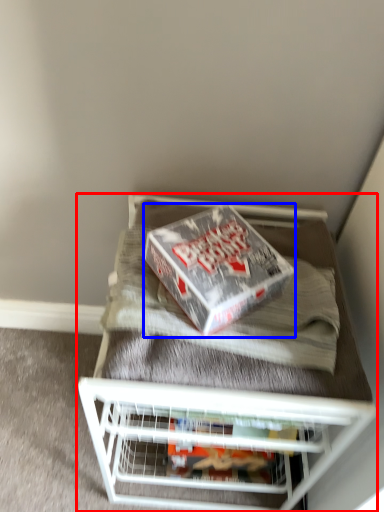
Question: Which object is further to the camera taking this photo, furniture (highlighted by a red box) or box (highlighted by a blue box)?

Choices:
 (A) furniture
 (B) box

Answer: (A)